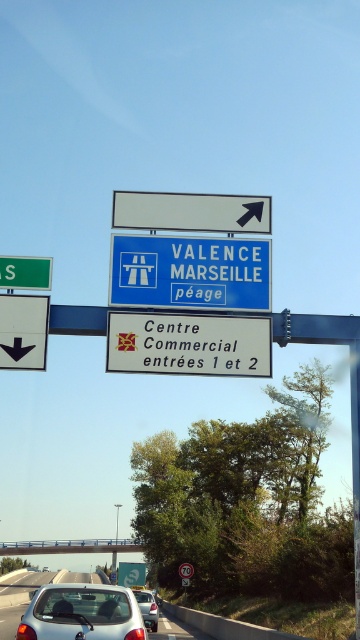
Question: Does semi-glossy silver car at center have a greater width compared to white glossy car at lower center?

Choices:
 (A) yes
 (B) no

Answer: (B)

Question: Is white paper sign at center closer to the viewer compared to green metallic sign at upper left?

Choices:
 (A) no
 (B) yes

Answer: (B)

Question: Is white paper sign at center smaller than green metallic sign at upper left?

Choices:
 (A) no
 (B) yes

Answer: (A)

Question: Which of the following is the closest to the observer?

Choices:
 (A) metallic circular sign at center
 (B) blue plastic sign at upper center

Answer: (B)

Question: Which object is the farthest from the blue plastic sign at upper center?

Choices:
 (A) silver metallic car at center
 (B) white glossy car at lower center

Answer: (B)

Question: Which is nearer to the blue plastic sign at upper center?

Choices:
 (A) semi-glossy silver car at center
 (B) green metallic sign at upper left
 (C) metallic circular sign at center
 (D) white glossy car at lower center

Answer: (B)